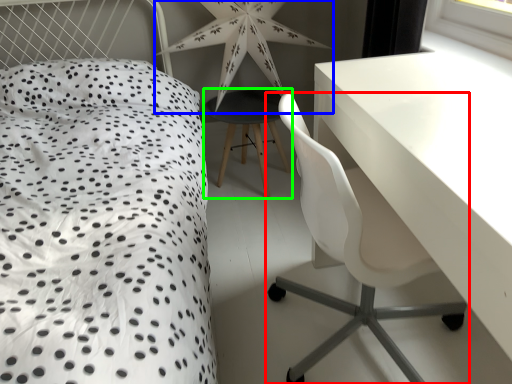
Question: Which object is the farthest from chair (highlighted by a red box)? Choose among these: star (highlighted by a blue box) or bar stool (highlighted by a green box).

Choices:
 (A) star
 (B) bar stool

Answer: (A)